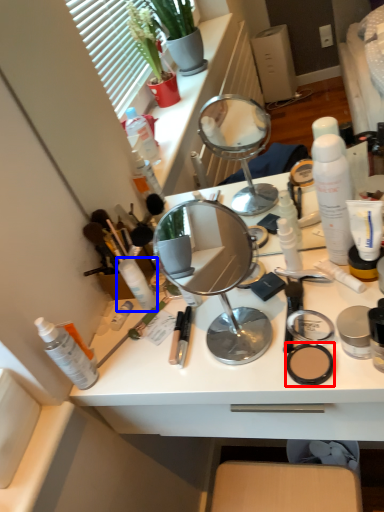
Question: Which of the following is the closest to the observer, face powder (highlighted by a red box) or toiletry (highlighted by a blue box)?

Choices:
 (A) face powder
 (B) toiletry

Answer: (A)